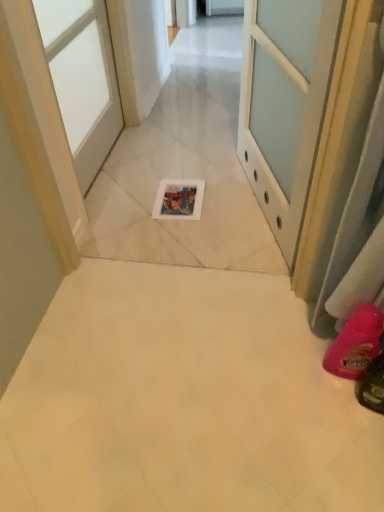
The image size is (384, 512). I want to click on vacant area that is in front of white glossy door at upper left, acting as the 1th door starting from the left, so click(x=139, y=210).